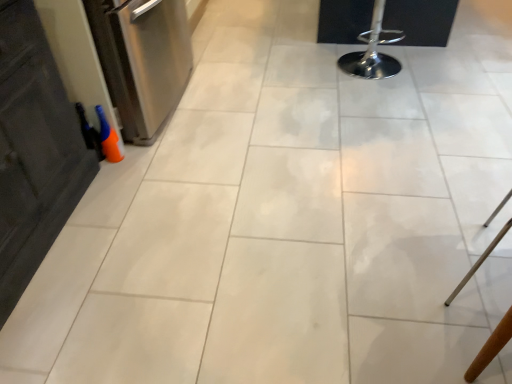
Question: Is wooden chair at lower right inside or outside of stainless steel dishwasher at left?

Choices:
 (A) inside
 (B) outside

Answer: (B)

Question: Looking at their shapes, would you say wooden chair at lower right is wider or thinner than stainless steel dishwasher at left?

Choices:
 (A) thin
 (B) wide

Answer: (A)

Question: Which of these objects is positioned farthest from the wooden chair at lower right?

Choices:
 (A) stainless steel dishwasher at left
 (B) polished chrome bar stool at upper right

Answer: (A)

Question: Estimate the real-world distances between objects in this image. Which object is closer to the stainless steel dishwasher at left?

Choices:
 (A) wooden chair at lower right
 (B) polished chrome bar stool at upper right

Answer: (B)